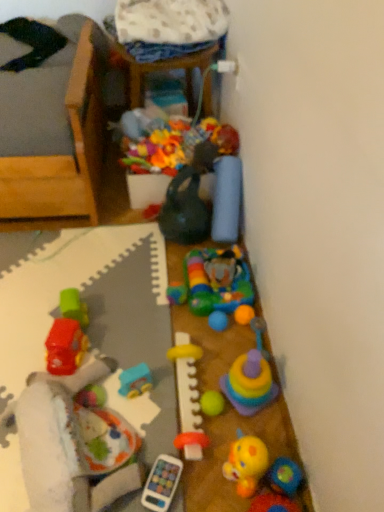
Find the location of a particular element. Image resolution: width=384 pixels, height=512 pixels. free space behind rubber duck at center, which is the 7th toy in left-to-right order is located at coordinates click(238, 418).